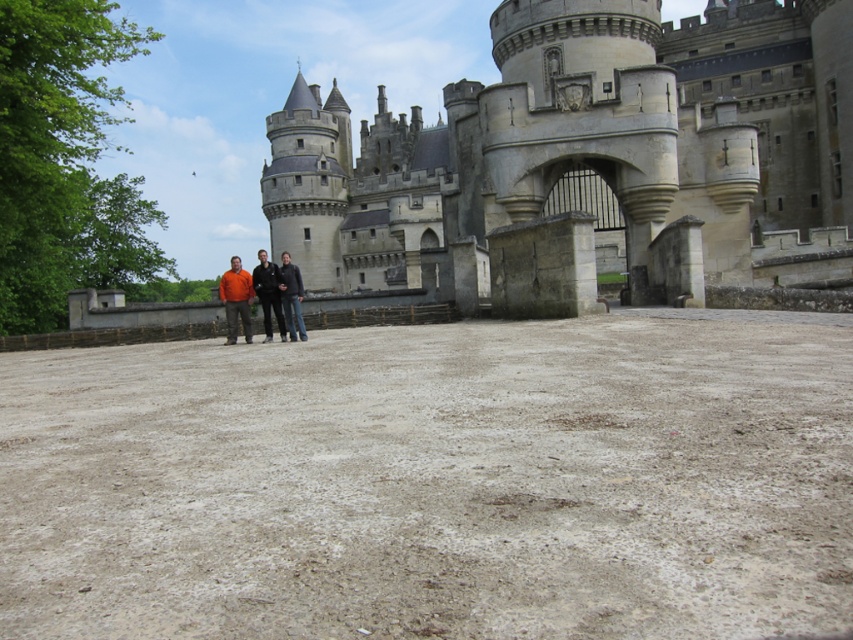
Question: Can you confirm if gray stone castle at center is positioned below orange fabric jacket at center?

Choices:
 (A) no
 (B) yes

Answer: (A)

Question: Is orange fabric jacket at center to the left of dark blue jeans at center from the viewer's perspective?

Choices:
 (A) no
 (B) yes

Answer: (A)

Question: Is orange matte shirt at center smaller than dark blue jeans at center?

Choices:
 (A) no
 (B) yes

Answer: (B)

Question: Which of the following is the closest to the observer?

Choices:
 (A) orange fabric jacket at center
 (B) dark blue jacket at center
 (C) dark blue jeans at center

Answer: (C)

Question: Which point is closer to the camera?

Choices:
 (A) orange matte shirt at center
 (B) orange fabric jacket at center
 (C) gray stone castle at center
 (D) dark blue jacket at center

Answer: (C)

Question: Which object appears farthest from the camera in this image?

Choices:
 (A) orange matte shirt at center
 (B) gray stone castle at center

Answer: (A)